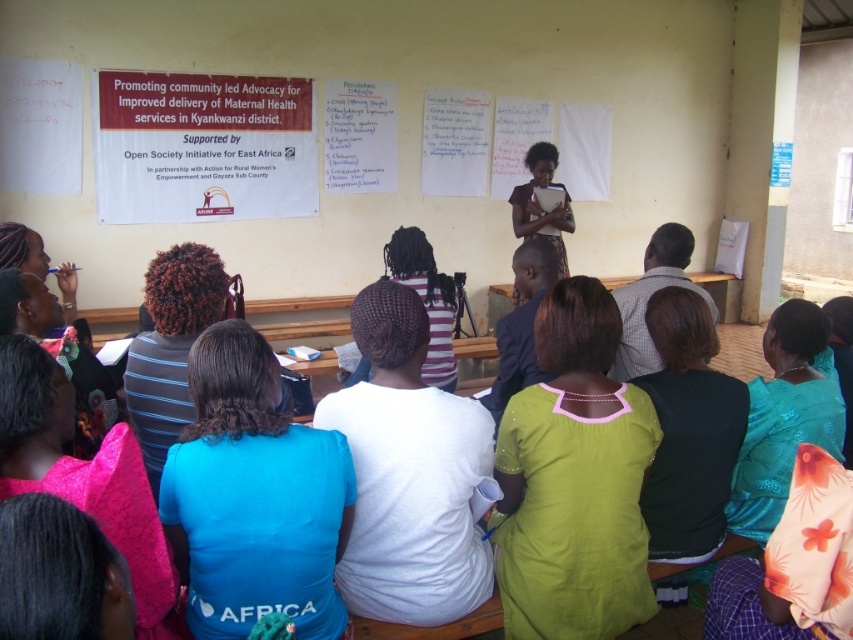
Who is lower down, blue fabric shirt at center or dark brown curly hair at center?

blue fabric shirt at center is below.

How much distance is there between blue fabric shirt at center and dark brown curly hair at center?

blue fabric shirt at center is 24.64 inches away from dark brown curly hair at center.

Where is `blue fabric shirt at center`? blue fabric shirt at center is located at coordinates (254, 497).

At what (x,y) coordinates should I click in order to perform the action: click on blue fabric shirt at center. Please return your answer as a coordinate pair (x, y). Looking at the image, I should click on click(x=254, y=497).

Is point (289, 440) positioned behind point (767, 448)?

No, it is not.

Who is more distant from viewer, (x=178, y=456) or (x=770, y=518)?

Point (x=770, y=518)

At what (x,y) coordinates should I click in order to perform the action: click on blue fabric shirt at center. Please return your answer as a coordinate pair (x, y). This screenshot has width=853, height=640. Looking at the image, I should click on (254, 497).

Does blue fabric shirt at center come in front of matte blue shirt at lower left?

No, blue fabric shirt at center is behind matte blue shirt at lower left.

Consider the image. Is blue fabric shirt at center shorter than matte blue shirt at lower left?

No.

Which is in front, point (274, 467) or point (138, 467)?

Point (138, 467)

The image size is (853, 640). What are the coordinates of `blue fabric shirt at center` in the screenshot? It's located at (254, 497).